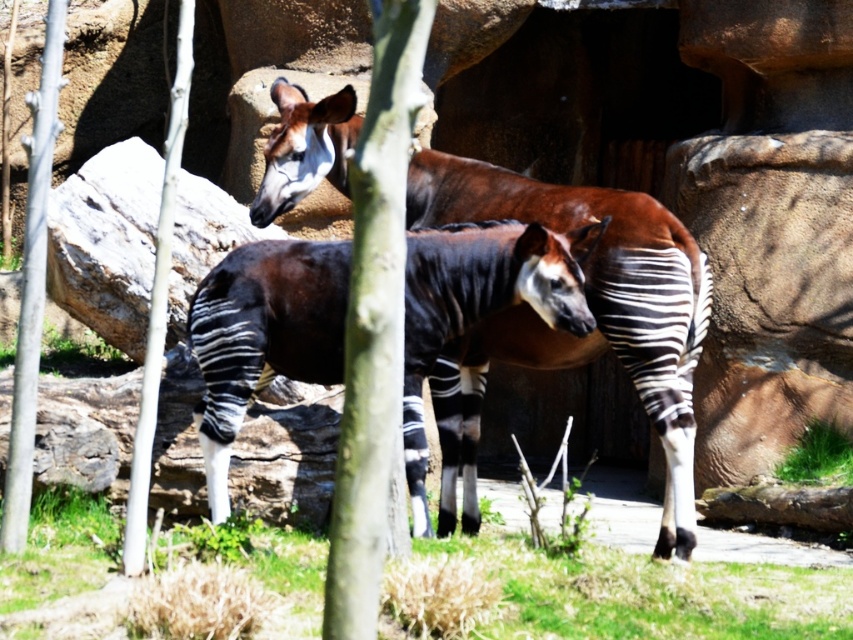
You are a zookeeper planning to place a feeding station between the green bark tree at center and the smooth bark tree at left. Since the feeding station requires a wider space, which tree should you position it closer to for better accommodation?

The green bark tree at center has a larger width than the smooth bark tree at left, so positioning the feeding station closer to the green bark tree at center would provide the necessary space for the feeding station.